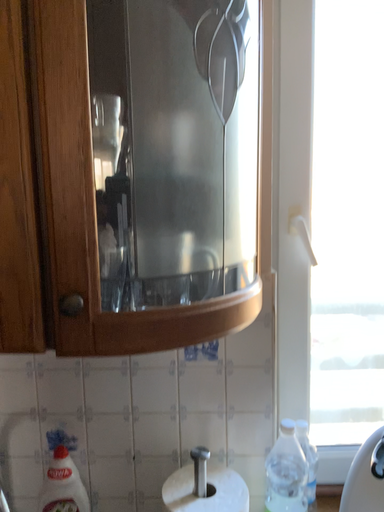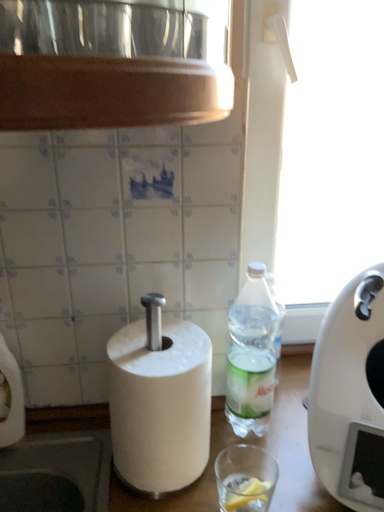
Question: Which way did the camera rotate in the video?

Choices:
 (A) rotated downward
 (B) rotated upward

Answer: (A)